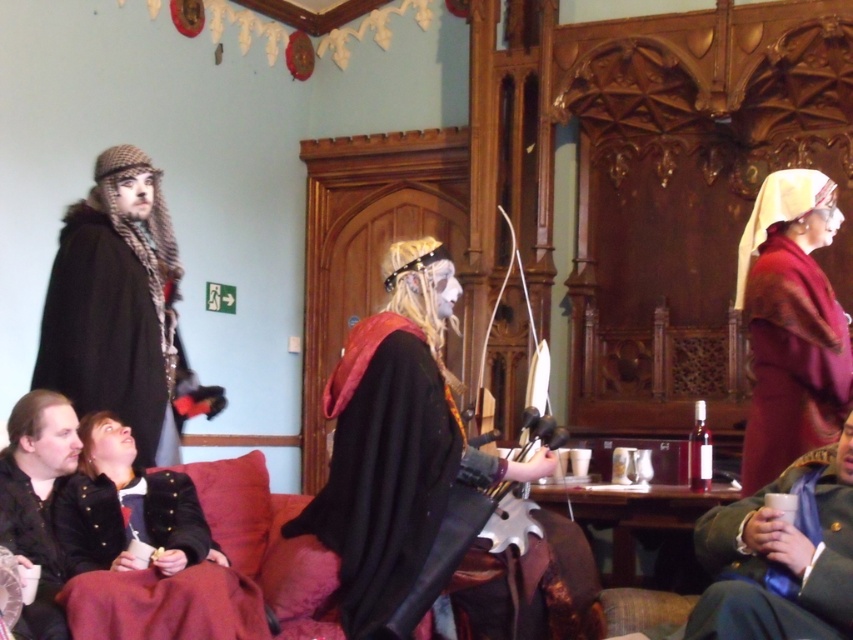
Question: Does matte black cape at center appear over velvet maroon dress at upper right?

Choices:
 (A) yes
 (B) no

Answer: (B)

Question: Which of the following is the closest to the observer?

Choices:
 (A) (42, 582)
 (B) (57, 481)

Answer: (A)

Question: Does velvet black coat at lower left appear on the right side of dark brown leather robe at lower left?

Choices:
 (A) yes
 (B) no

Answer: (A)

Question: Among these objects, which one is farthest from the camera?

Choices:
 (A) dark brown woolen robe at left
 (B) dark brown leather robe at lower left
 (C) matte black cape at center
 (D) black leather jacket at lower left

Answer: (A)

Question: Which object appears closest to the camera in this image?

Choices:
 (A) velvet maroon dress at upper right
 (B) green fabric jacket at lower right

Answer: (B)

Question: Observing the image, what is the correct spatial positioning of matte black cape at center in reference to dark brown leather robe at lower left?

Choices:
 (A) below
 (B) above

Answer: (B)